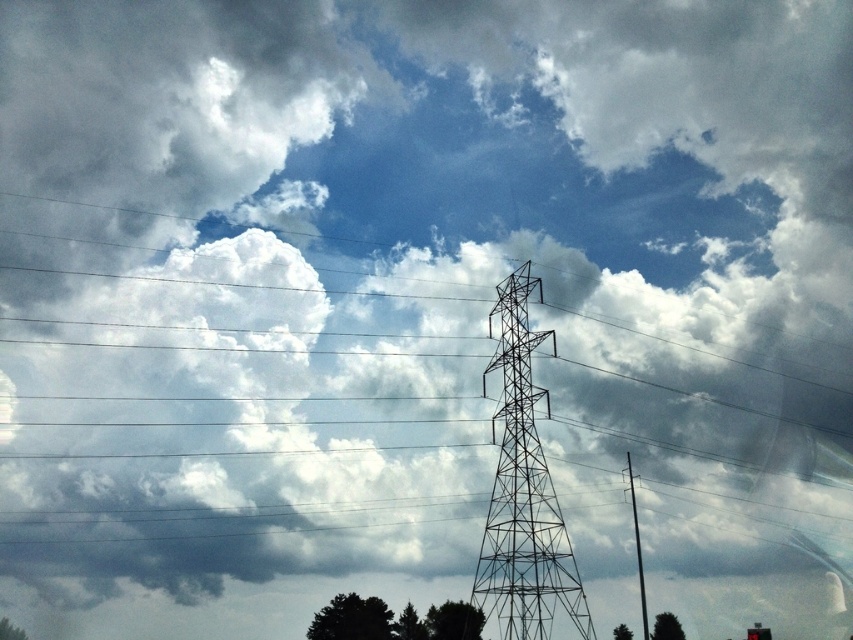
You are a bird flying in the sky and want to land on the metallic wire tower at center. The coordinates of the tower are given as point (523, 492). Can you confirm if this point is part of the tower?

Yes, the point (523, 492) is on the metallic wire tower at center, so the bird can land there.

You are standing at the base of the metallic wire tower at center. You want to walk to a picnic spot located 200 meters away from the tower. If you start walking directly away from the tower, how many more meters do you need to walk to reach the picnic spot?

You are currently 164.66 meters away from the metallic wire tower at center. To reach the picnic spot located 200 meters away from the tower, you need to walk an additional 35.34 meters.